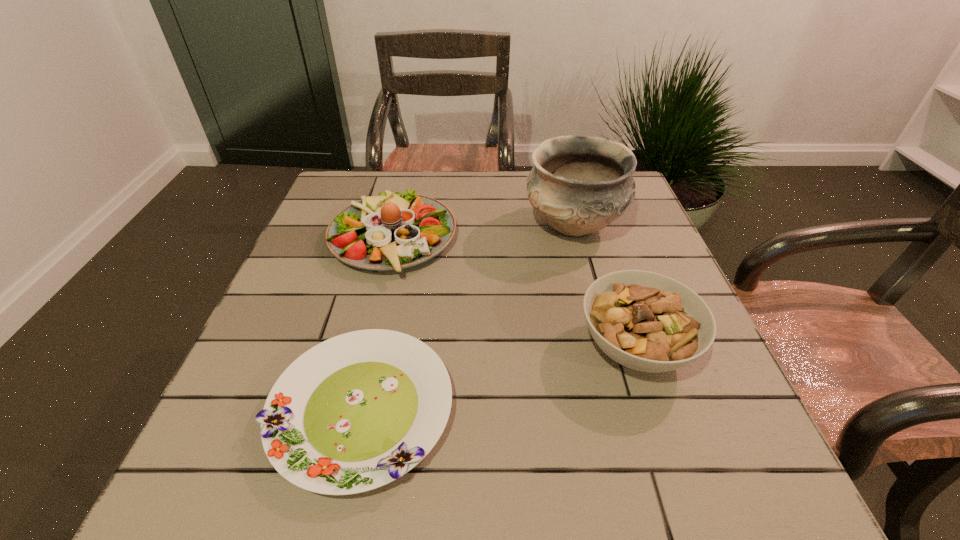
The image size is (960, 540). I want to click on free spot between the stew and the shortest object, so (x=498, y=379).

Where is `object that can be found as the closest to the taller salad plate`? object that can be found as the closest to the taller salad plate is located at coordinates (357, 411).

Identify which object is located as the nearest to the stew. Please provide its 2D coordinates. Your answer should be formatted as a tuple, i.e. [(x, y)], where the tuple contains the x and y coordinates of a point satisfying the conditions above.

[(579, 184)]

The height and width of the screenshot is (540, 960). Find the location of `vacant space that satisfies the following two spatial constraints: 1. on the back side of the pottery; 2. on the left side of the shorter salad plate`. vacant space that satisfies the following two spatial constraints: 1. on the back side of the pottery; 2. on the left side of the shorter salad plate is located at coordinates (402, 226).

Identify the location of free space that satisfies the following two spatial constraints: 1. on the front side of the nearer salad plate; 2. on the right side of the farther salad plate. This screenshot has height=540, width=960. (351, 410).